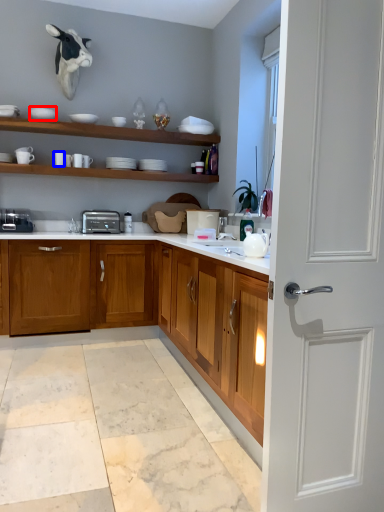
Question: Which of the following is the closest to the observer, tableware (highlighted by a red box) or tableware (highlighted by a blue box)?

Choices:
 (A) tableware
 (B) tableware

Answer: (A)